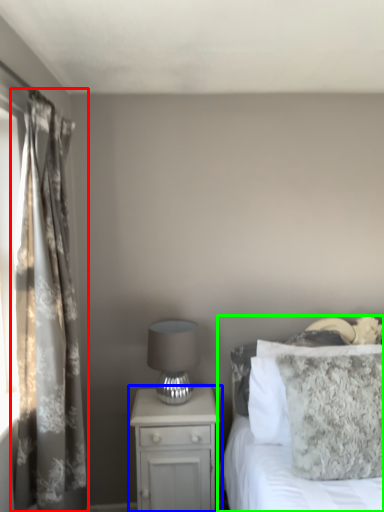
Question: Considering the real-world distances, which object is farthest from curtain (highlighted by a red box)? nightstand (highlighted by a blue box) or bed (highlighted by a green box)?

Choices:
 (A) nightstand
 (B) bed

Answer: (B)